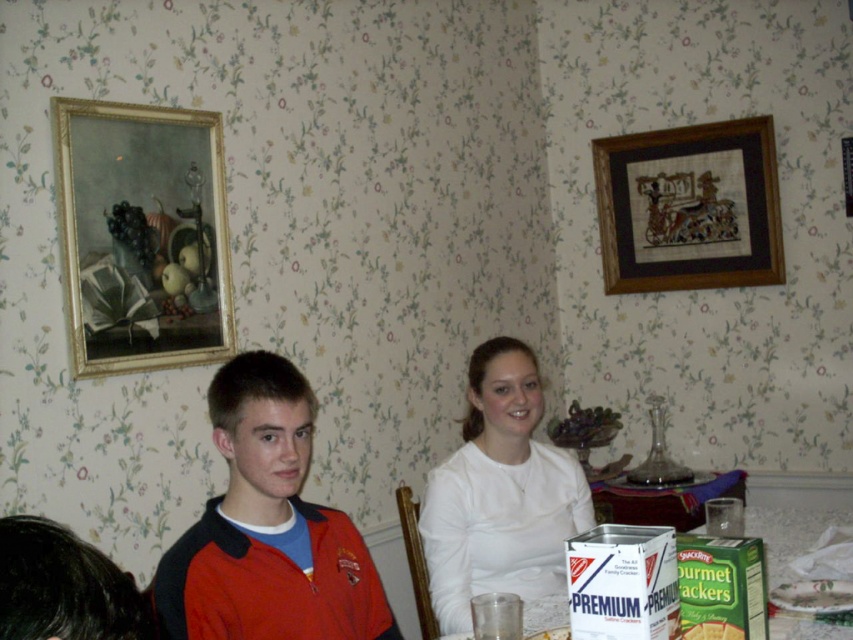
Which of these two, gold/gilded picture frame at upper left or white matte shirt at center, stands shorter?

With less height is white matte shirt at center.

Can you confirm if gold/gilded picture frame at upper left is positioned above white matte shirt at center?

Yes.

I want to click on gold/gilded picture frame at upper left, so click(x=142, y=236).

You are a GUI agent. You are given a task and a screenshot of the screen. Output one action in this format:
    pyautogui.click(x=<x>, y=<y>)
    Task: Click on the gold/gilded picture frame at upper left
    The width and height of the screenshot is (853, 640).
    Given the screenshot: What is the action you would take?
    pyautogui.click(x=142, y=236)

Where is `red jacket at center`? The height and width of the screenshot is (640, 853). red jacket at center is located at coordinates (267, 529).

Who is more forward, (225,566) or (511,467)?

Point (225,566) is in front.

What do you see at coordinates (267, 529) in the screenshot?
I see `red jacket at center` at bounding box center [267, 529].

Identify the location of red jacket at center. pyautogui.click(x=267, y=529).

Does red jacket at center have a greater height compared to white cardboard box at lower center?

Indeed, red jacket at center has a greater height compared to white cardboard box at lower center.

This screenshot has width=853, height=640. In order to click on red jacket at center in this screenshot , I will do `click(267, 529)`.